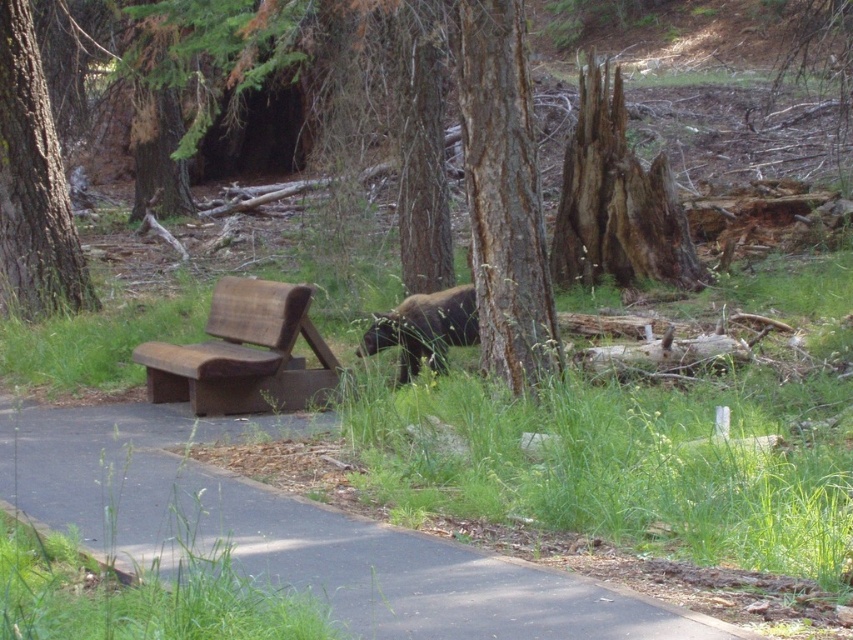
Can you confirm if brown rough bark tree at left is shorter than brown furry bear at center?

In fact, brown rough bark tree at left may be taller than brown furry bear at center.

Describe the element at coordinates (33, 182) in the screenshot. The height and width of the screenshot is (640, 853). I see `brown rough bark tree at left` at that location.

Locate an element on the screen. The image size is (853, 640). brown rough bark tree at left is located at coordinates (33, 182).

Locate an element on the screen. The image size is (853, 640). brown rough bark tree at left is located at coordinates (x=33, y=182).

Who is lower down, rough bark tree at center or brown furry bear at center?

brown furry bear at center is below.

Measure the distance between rough bark tree at center and brown furry bear at center.

rough bark tree at center and brown furry bear at center are 2.36 meters apart.

Which is in front, point (485, 337) or point (454, 305)?

Point (485, 337)

Find the location of a particular element. This screenshot has width=853, height=640. rough bark tree at center is located at coordinates (503, 196).

This screenshot has width=853, height=640. I want to click on black asphalt pavement at lower left, so click(294, 531).

From the picture: Does black asphalt pavement at lower left have a smaller size compared to brown rough bark tree at left?

Yes, black asphalt pavement at lower left is smaller than brown rough bark tree at left.

Who is more distant from viewer, (32, 504) or (28, 68)?

The point (28, 68) is behind.

Locate an element on the screen. black asphalt pavement at lower left is located at coordinates (294, 531).